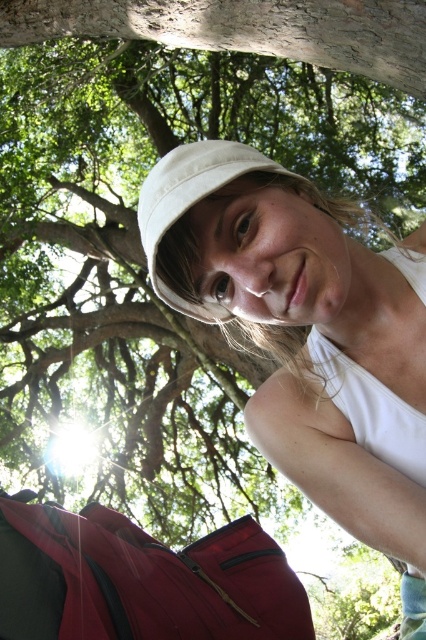
Question: Is the position of smooth bark tree trunk at upper center more distant than that of white cotton hat at center?

Choices:
 (A) no
 (B) yes

Answer: (B)

Question: Is smooth bark tree trunk at upper center behind white cotton hat at center?

Choices:
 (A) yes
 (B) no

Answer: (A)

Question: Which point is farther to the camera?

Choices:
 (A) (166, 176)
 (B) (279, 4)

Answer: (B)

Question: Is the position of white matte hat at center more distant than that of white cotton hat at center?

Choices:
 (A) no
 (B) yes

Answer: (A)

Question: Based on their relative distances, which object is nearer to the matte red backpack at lower left?

Choices:
 (A) white cotton hat at center
 (B) white matte hat at center

Answer: (B)

Question: Estimate the real-world distances between objects in this image. Which object is farther from the matte red backpack at lower left?

Choices:
 (A) white matte hat at center
 (B) white cotton hat at center
 (C) smooth bark tree trunk at upper center

Answer: (C)